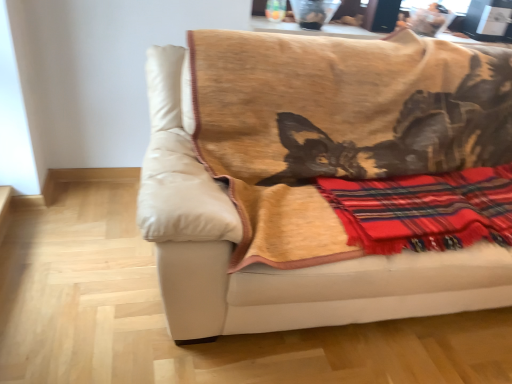
Question: Is beige leather couch at center inside or outside of red plaid blanket at right?

Choices:
 (A) outside
 (B) inside

Answer: (A)

Question: Based on their positions, is beige leather couch at center located to the left or right of red plaid blanket at right?

Choices:
 (A) left
 (B) right

Answer: (A)

Question: Considering their positions, is beige leather couch at center located in front of or behind red plaid blanket at right?

Choices:
 (A) front
 (B) behind

Answer: (A)

Question: From a real-world perspective, is red plaid blanket at right positioned above or below beige leather couch at center?

Choices:
 (A) below
 (B) above

Answer: (B)

Question: From the image's perspective, is red plaid blanket at right positioned above or below beige leather couch at center?

Choices:
 (A) below
 (B) above

Answer: (A)

Question: Is red plaid blanket at right taller or shorter than beige leather couch at center?

Choices:
 (A) tall
 (B) short

Answer: (B)

Question: Considering their positions, is red plaid blanket at right located in front of or behind beige leather couch at center?

Choices:
 (A) front
 (B) behind

Answer: (B)